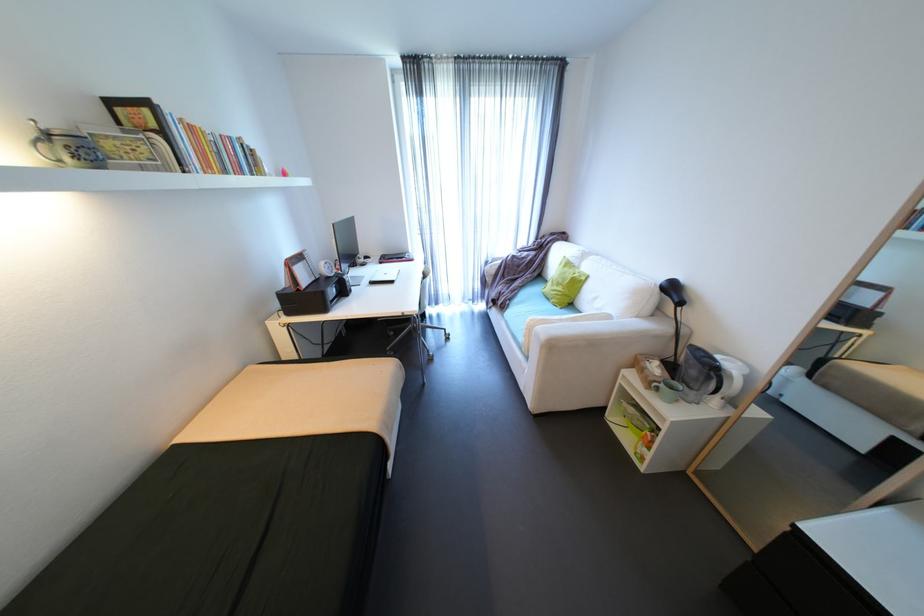
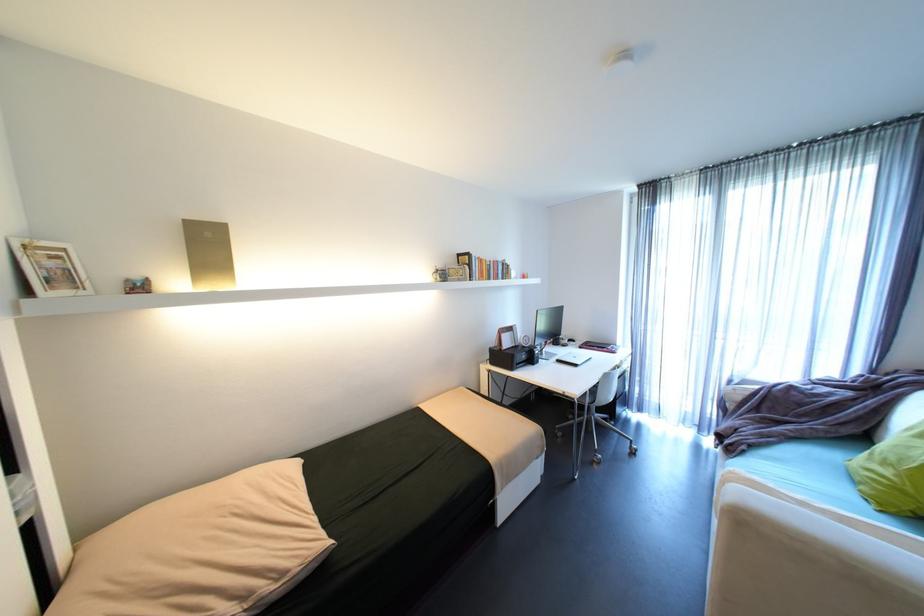
In the second image, find the point that corresponds to point 375,286 in the first image.

(562, 363)